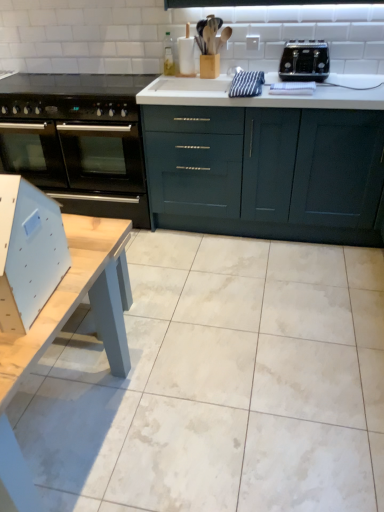
Measure the distance between point [182,170] and camera.

8.78 feet.

The height and width of the screenshot is (512, 384). Describe the element at coordinates (266, 159) in the screenshot. I see `matte dark blue cabinets at center` at that location.

In order to click on light blue plastic chair at lower left in this screenshot , I will do `click(28, 252)`.

Describe the element at coordinates (28, 252) in the screenshot. I see `light blue plastic chair at lower left` at that location.

Where is `light wood table at lower left`? The width and height of the screenshot is (384, 512). light wood table at lower left is located at coordinates (61, 328).

Identify the location of toaster on the right of light wood table at lower left. (305, 61).

Considering the positions of point (328, 57) and point (51, 317), is point (328, 57) closer or farther from the camera than point (51, 317)?

Point (328, 57) appears to be farther away from the viewer than point (51, 317).

Is black plastic toaster at upper right located outside light wood table at lower left?

Yes, black plastic toaster at upper right is not within light wood table at lower left.

Is black plastic toaster at upper right far from light wood table at lower left?

Indeed, black plastic toaster at upper right is not near light wood table at lower left.

Considering the relative sizes of light wood table at lower left and black plastic toaster at upper right in the image provided, is light wood table at lower left thinner than black plastic toaster at upper right?

No, light wood table at lower left is not thinner than black plastic toaster at upper right.

Can black plastic toaster at upper right be found inside light wood table at lower left?

No, black plastic toaster at upper right is not surrounded by light wood table at lower left.

Who is taller, light wood table at lower left or black plastic toaster at upper right?

Standing taller between the two is light wood table at lower left.

Locate an element on the screen. Image resolution: width=384 pixels, height=512 pixels. toaster to the right of light wood table at lower left is located at coordinates (305, 61).

Which is more to the left, light blue plastic chair at lower left or black glass oven at left?

From the viewer's perspective, black glass oven at left appears more on the left side.

Which object is wider, light blue plastic chair at lower left or black glass oven at left?

With larger width is black glass oven at left.

Is light blue plastic chair at lower left outside of black glass oven at left?

Yes, light blue plastic chair at lower left is not within black glass oven at left.

From a real-world perspective, is light blue plastic chair at lower left over black glass oven at left?

Yes, from a real-world perspective, light blue plastic chair at lower left is above black glass oven at left.

Looking at this image, can you tell me how much black glass oven at left and black plastic toaster at upper right differ in facing direction?

4.86 degrees separate the facing orientations of black glass oven at left and black plastic toaster at upper right.

Which of these two, black glass oven at left or black plastic toaster at upper right, is thinner?

With smaller width is black plastic toaster at upper right.

Considering the sizes of objects black glass oven at left and black plastic toaster at upper right in the image provided, who is smaller, black glass oven at left or black plastic toaster at upper right?

black plastic toaster at upper right.

Is black glass oven at left to the left of black plastic toaster at upper right from the viewer's perspective?

Yes.

Is light blue plastic chair at lower left in front of or behind matte dark blue cabinets at center in the image?

light blue plastic chair at lower left is positioned closer to the viewer than matte dark blue cabinets at center.

Which of these two, light blue plastic chair at lower left or matte dark blue cabinets at center, is smaller?

With smaller size is light blue plastic chair at lower left.

Which point is more distant from viewer, (43,291) or (380,181)?

The point (380,181) is farther from the camera.

From a real-world perspective, is light blue plastic chair at lower left physically located above or below matte dark blue cabinets at center?

light blue plastic chair at lower left is above matte dark blue cabinets at center.

Is point (306, 41) closer to camera compared to point (192, 194)?

Yes, it is.

Which is correct: black plastic toaster at upper right is inside matte dark blue cabinets at center, or outside of it?

black plastic toaster at upper right cannot be found inside matte dark blue cabinets at center.

Does black plastic toaster at upper right lie in front of matte dark blue cabinets at center?

No.

Is the depth of black glass oven at left less than that of matte dark blue cabinets at center?

No, the depth of black glass oven at left is greater than that of matte dark blue cabinets at center.

Is black glass oven at left facing towards matte dark blue cabinets at center?

No, black glass oven at left is not aimed at matte dark blue cabinets at center.

Is black glass oven at left not within matte dark blue cabinets at center?

Yes, black glass oven at left is not within matte dark blue cabinets at center.

Can you confirm if black glass oven at left is shorter than matte dark blue cabinets at center?

Yes.

The image size is (384, 512). I want to click on table lying in front of the black plastic toaster at upper right, so click(61, 328).

You are a GUI agent. You are given a task and a screenshot of the screen. Output one action in this format:
    pyautogui.click(x=<x>, y=<y>)
    Task: Click on the table lying below the black plastic toaster at upper right (from the image's perspective)
    The image size is (384, 512).
    Given the screenshot: What is the action you would take?
    pyautogui.click(x=61, y=328)

Based on the photo, estimate the real-world distances between objects in this image. Which object is closer to light blue plastic chair at lower left, black plastic toaster at upper right or light wood table at lower left?

The object closer to light blue plastic chair at lower left is light wood table at lower left.

Based on their spatial positions, is light blue plastic chair at lower left or black plastic toaster at upper right closer to matte dark blue cabinets at center?

Based on the image, black plastic toaster at upper right appears to be nearer to matte dark blue cabinets at center.

Estimate the real-world distances between objects in this image. Which object is closer to light blue plastic chair at lower left, black glass oven at left or black plastic toaster at upper right?

black glass oven at left.

Based on their spatial positions, is matte dark blue cabinets at center or light blue plastic chair at lower left closer to black plastic toaster at upper right?

matte dark blue cabinets at center.

Estimate the real-world distances between objects in this image. Which object is closer to black glass oven at left, light wood table at lower left or black plastic toaster at upper right?

light wood table at lower left.

Consider the image. Looking at the image, which one is located closer to matte dark blue cabinets at center, light blue plastic chair at lower left or light wood table at lower left?

light wood table at lower left.

Considering their positions, is black glass oven at left positioned closer to black plastic toaster at upper right than light blue plastic chair at lower left?

black glass oven at left.

From the image, which object appears to be nearer to matte dark blue cabinets at center, black glass oven at left or black plastic toaster at upper right?

The object closer to matte dark blue cabinets at center is black plastic toaster at upper right.

Where is `toaster between light wood table at lower left and black glass oven at left along the z-axis`? toaster between light wood table at lower left and black glass oven at left along the z-axis is located at coordinates (305, 61).

I want to click on cabinetry between black glass oven at left and black plastic toaster at upper right from left to right, so click(266, 159).

You are a GUI agent. You are given a task and a screenshot of the screen. Output one action in this format:
    pyautogui.click(x=<x>, y=<y>)
    Task: Click on the appliance between light wood table at lower left and black plastic toaster at upper right from front to back
    The image size is (384, 512).
    Given the screenshot: What is the action you would take?
    pyautogui.click(x=28, y=252)

This screenshot has width=384, height=512. What are the coordinates of `cabinetry between light wood table at lower left and black glass oven at left in the front-back direction` in the screenshot? It's located at (266, 159).